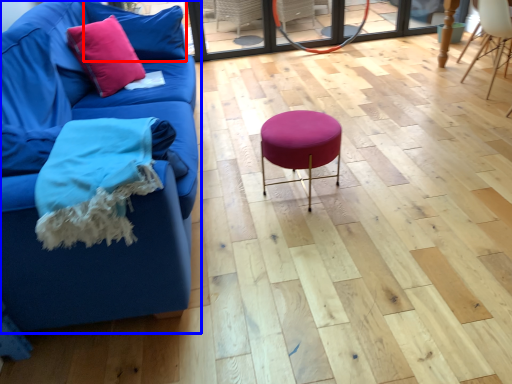
Question: Which object appears farthest to the camera in this image, pillow (highlighted by a red box) or studio couch (highlighted by a blue box)?

Choices:
 (A) pillow
 (B) studio couch

Answer: (A)